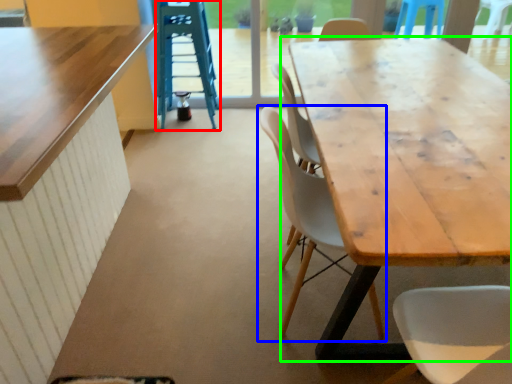
Question: Considering the real-world distances, which object is farthest from ladder (highlighted by a red box)? chair (highlighted by a blue box) or table (highlighted by a green box)?

Choices:
 (A) chair
 (B) table

Answer: (A)